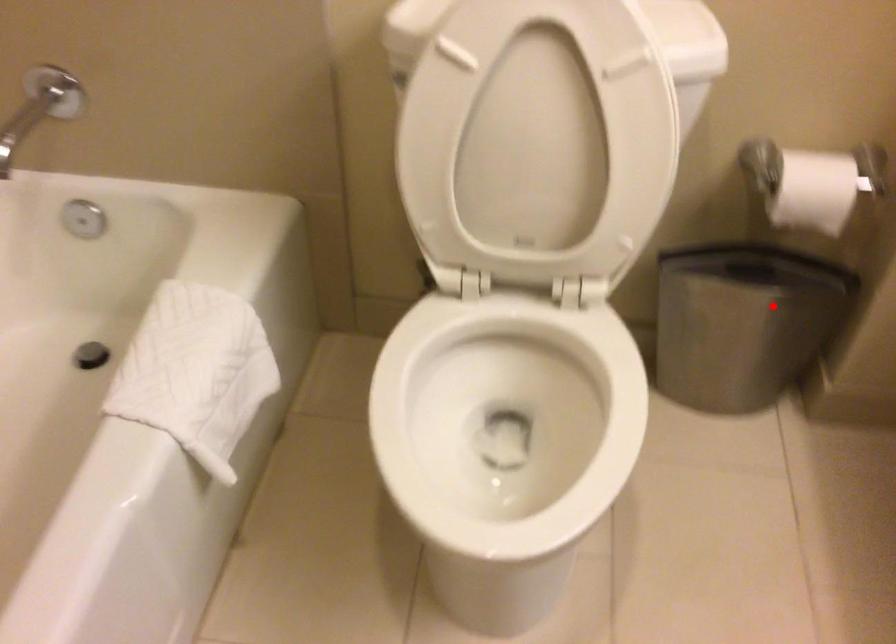
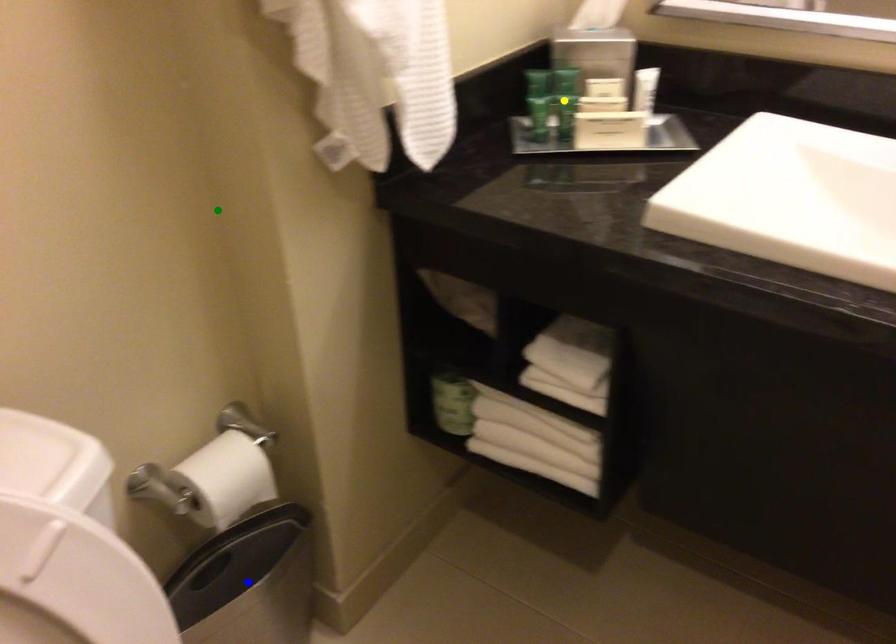
Question: I am providing you with two images of the same scene from different viewpoints. A red point is marked on the first image. You are given multiple points on the second image. Which spot in image 2 lines up with the point in image 1?

Choices:
 (A) yellow point
 (B) green point
 (C) blue point

Answer: (C)